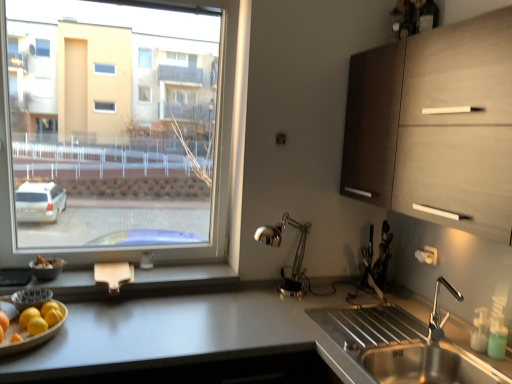
Question: Is polished metal desk lamp at center turned away from wooden at lower left?

Choices:
 (A) no
 (B) yes

Answer: (A)

Question: Is wooden at lower left completely or partially inside polished metal desk lamp at center?

Choices:
 (A) no
 (B) yes

Answer: (A)

Question: Is polished metal desk lamp at center further to the viewer compared to wooden at lower left?

Choices:
 (A) no
 (B) yes

Answer: (B)

Question: Does polished metal desk lamp at center have a greater width compared to wooden at lower left?

Choices:
 (A) yes
 (B) no

Answer: (A)

Question: Is polished metal desk lamp at center not near wooden at lower left?

Choices:
 (A) no
 (B) yes

Answer: (A)

Question: In terms of height, does matte black bowl at lower left look taller or shorter compared to stainless steel sink at lower right?

Choices:
 (A) tall
 (B) short

Answer: (B)

Question: From the image's perspective, is matte black bowl at lower left located above or below stainless steel sink at lower right?

Choices:
 (A) below
 (B) above

Answer: (B)

Question: In terms of width, does matte black bowl at lower left look wider or thinner when compared to stainless steel sink at lower right?

Choices:
 (A) thin
 (B) wide

Answer: (A)

Question: In the image, is matte black bowl at lower left positioned in front of or behind stainless steel sink at lower right?

Choices:
 (A) behind
 (B) front

Answer: (A)

Question: Is wooden tray with fruits at lower left taller or shorter than green translucent soap dispenser at lower right?

Choices:
 (A) short
 (B) tall

Answer: (A)

Question: Based on their sizes in the image, would you say wooden tray with fruits at lower left is bigger or smaller than green translucent soap dispenser at lower right?

Choices:
 (A) small
 (B) big

Answer: (B)

Question: Considering the positions of point (40, 334) and point (484, 327), is point (40, 334) closer or farther from the camera than point (484, 327)?

Choices:
 (A) farther
 (B) closer

Answer: (B)

Question: In the image, is wooden tray with fruits at lower left on the left side or the right side of green translucent soap dispenser at lower right?

Choices:
 (A) left
 (B) right

Answer: (A)

Question: From a real-world perspective, is wooden tray with fruits at lower left above or below matte black bowl at lower left?

Choices:
 (A) below
 (B) above

Answer: (A)

Question: Looking at their shapes, would you say wooden tray with fruits at lower left is wider or thinner than matte black bowl at lower left?

Choices:
 (A) wide
 (B) thin

Answer: (A)